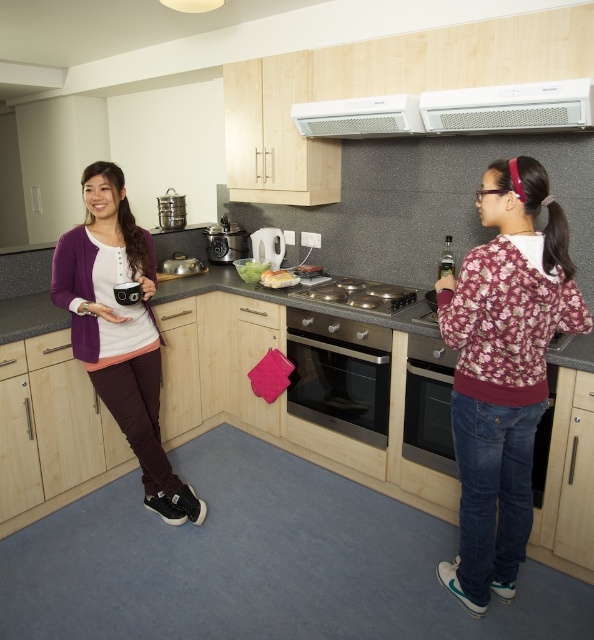
You are trying to place a rectangular cutting board on the granite gray countertop at center. The cutting board is as wide as the white plastic exhaust hood at upper center. Will it fit on the countertop?

The granite gray countertop at center is wider than the white plastic exhaust hood at upper center, so the cutting board will fit on the countertop since its width matches the exhaust hood and the countertop is wider.

In the scene shown: You are standing in the kitchen and want to place a small item on the counter. There are two points marked on the counter where you can place it. The first point is at coordinate point (482, 218) and the second is at point (273, 241). If you want to place the item closer to you, which coordinate should you choose?

Point (482, 218) is in front of point (273, 241), so placing the item at point (482, 218) would be closer to you.